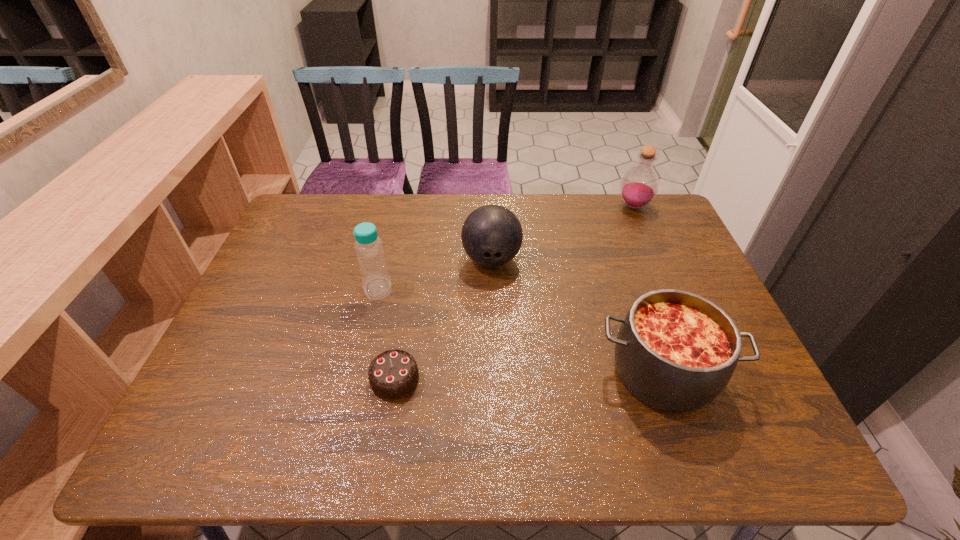
Locate an element on the screen. the farthest object is located at coordinates 639,186.

I want to click on the right bottle, so click(639, 186).

Where is `the nearer bottle`? The image size is (960, 540). the nearer bottle is located at coordinates (376, 283).

At what (x,y) coordinates should I click in order to perform the action: click on the third object from right to left. Please return your answer as a coordinate pair (x, y). The height and width of the screenshot is (540, 960). Looking at the image, I should click on (492, 235).

At what (x,y) coordinates should I click in order to perform the action: click on casserole. Please return your answer as a coordinate pair (x, y). The width and height of the screenshot is (960, 540). Looking at the image, I should click on (676, 351).

Identify the location of chocolate cake. (393, 375).

In order to click on vacant space located 0.270m on the front of the right bottle in this screenshot , I will do `click(662, 273)`.

The width and height of the screenshot is (960, 540). I want to click on free space located on the left of the nearer bottle, so [313, 288].

Find the location of a particular element. The height and width of the screenshot is (540, 960). free space located 0.060m on the grip area of the third object from right to left is located at coordinates (492, 295).

Find the location of a particular element. The width and height of the screenshot is (960, 540). vacant space located on the left of the casserole is located at coordinates (535, 373).